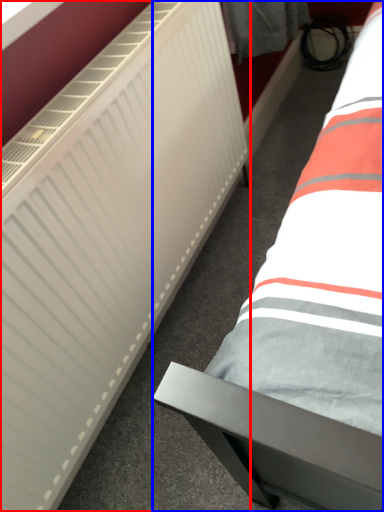
Question: Which object is further to the camera taking this photo, radiator (highlighted by a red box) or bed (highlighted by a blue box)?

Choices:
 (A) radiator
 (B) bed

Answer: (B)